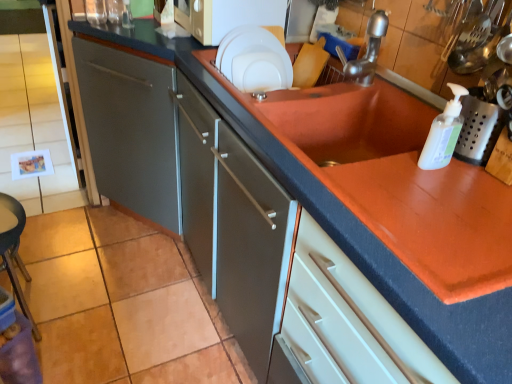
What do you see at coordinates (366, 51) in the screenshot? This screenshot has height=384, width=512. I see `silver metallic faucet at upper right` at bounding box center [366, 51].

The height and width of the screenshot is (384, 512). In order to click on white glossy plate at upper center in this screenshot , I will do (255, 59).

Considering the sizes of silver metallic faucet at upper right and white matte microwave at upper center in the image, is silver metallic faucet at upper right bigger or smaller than white matte microwave at upper center?

silver metallic faucet at upper right is smaller than white matte microwave at upper center.

Can you confirm if silver metallic faucet at upper right is shorter than white matte microwave at upper center?

Yes.

Is silver metallic faucet at upper right facing away from white matte microwave at upper center?

silver metallic faucet at upper right does not have its back to white matte microwave at upper center.

Can you tell me how much white plastic soap dispenser at upper right and white glossy plate at upper center differ in facing direction?

The angular difference between white plastic soap dispenser at upper right and white glossy plate at upper center is 83.6 degrees.

From the image's perspective, is white plastic soap dispenser at upper right under white glossy plate at upper center?

Yes, from the image's perspective, white plastic soap dispenser at upper right is beneath white glossy plate at upper center.

Does white plastic soap dispenser at upper right touch white glossy plate at upper center?

There is a gap between white plastic soap dispenser at upper right and white glossy plate at upper center.

Is point (440, 167) in front of point (258, 76)?

Yes, it is.

Based on their positions, is silver metallic faucet at upper right located to the left or right of white glossy plate at upper center?

In the image, silver metallic faucet at upper right appears on the right side of white glossy plate at upper center.

Does silver metallic faucet at upper right contain white glossy plate at upper center?

Definitely not — white glossy plate at upper center is not inside silver metallic faucet at upper right.

The height and width of the screenshot is (384, 512). Identify the location of tap lying above the white glossy plate at upper center (from the image's perspective). (366, 51).

From a real-world perspective, is silver metallic faucet at upper right over white glossy plate at upper center?

Indeed, from a real-world perspective, silver metallic faucet at upper right stands above white glossy plate at upper center.

Find the location of a particular element. microwave above the white plastic soap dispenser at upper right (from the image's perspective) is located at coordinates (226, 16).

Could you measure the distance between white plastic soap dispenser at upper right and white matte microwave at upper center?

white plastic soap dispenser at upper right and white matte microwave at upper center are 32.33 inches apart.

Based on the photo, which of these two, white plastic soap dispenser at upper right or white matte microwave at upper center, is smaller?

white plastic soap dispenser at upper right.

Can you confirm if white plastic soap dispenser at upper right is wider than white matte microwave at upper center?

No, white plastic soap dispenser at upper right is not wider than white matte microwave at upper center.

Considering the positions of points (257, 41) and (369, 70), is point (257, 41) farther from camera compared to point (369, 70)?

Yes, it is behind point (369, 70).

From the image's perspective, which one is positioned lower, white glossy plate at upper center or silver metallic faucet at upper right?

From the image's view, white glossy plate at upper center is below.

Considering the sizes of objects white glossy plate at upper center and silver metallic faucet at upper right in the image provided, who is wider, white glossy plate at upper center or silver metallic faucet at upper right?

With larger width is silver metallic faucet at upper right.

Is white glossy plate at upper center next to silver metallic faucet at upper right?

No, white glossy plate at upper center is not next to silver metallic faucet at upper right.

Based on the photo, between white glossy plate at upper center and white matte microwave at upper center, which one is positioned behind?

Positioned behind is white matte microwave at upper center.

From the image's perspective, is white glossy plate at upper center located above white matte microwave at upper center?

No, from the image's perspective, white glossy plate at upper center is not above white matte microwave at upper center.

Locate an element on the screen. The height and width of the screenshot is (384, 512). microwave located above the white glossy plate at upper center (from the image's perspective) is located at coordinates (226, 16).

Is silver metallic faucet at upper right positioned far away from white plastic soap dispenser at upper right?

No.

Consider the image. Is white plastic soap dispenser at upper right completely or partially inside silver metallic faucet at upper right?

That's incorrect, white plastic soap dispenser at upper right is not inside silver metallic faucet at upper right.

From the picture: Is silver metallic faucet at upper right turned away from white plastic soap dispenser at upper right?

silver metallic faucet at upper right does not have its back to white plastic soap dispenser at upper right.

The height and width of the screenshot is (384, 512). In order to click on microwave that appears behind the silver metallic faucet at upper right in this screenshot , I will do `click(226, 16)`.

There is a white glossy plate at upper center. Where is `bottle above it (from a real-world perspective)`? bottle above it (from a real-world perspective) is located at coordinates (443, 133).

Based on their spatial positions, is white plastic soap dispenser at upper right or white glossy plate at upper center further from white matte microwave at upper center?

white plastic soap dispenser at upper right is further to white matte microwave at upper center.

Based on their spatial positions, is white plastic soap dispenser at upper right or white matte microwave at upper center further from white glossy plate at upper center?

white plastic soap dispenser at upper right lies further to white glossy plate at upper center than the other object.

When comparing their distances from white glossy plate at upper center, does white plastic soap dispenser at upper right or silver metallic faucet at upper right seem closer?

silver metallic faucet at upper right lies closer to white glossy plate at upper center than the other object.

From the image, which object appears to be farther from white glossy plate at upper center, silver metallic faucet at upper right or white matte microwave at upper center?

Based on the image, silver metallic faucet at upper right appears to be further to white glossy plate at upper center.

Estimate the real-world distances between objects in this image. Which object is closer to silver metallic faucet at upper right, white plastic soap dispenser at upper right or white glossy plate at upper center?

white glossy plate at upper center is closer to silver metallic faucet at upper right.

When comparing their distances from white glossy plate at upper center, does white matte microwave at upper center or silver metallic faucet at upper right seem further?

Based on the image, silver metallic faucet at upper right appears to be further to white glossy plate at upper center.

From the image, which object appears to be nearer to white plastic soap dispenser at upper right, white matte microwave at upper center or white glossy plate at upper center?

Among the two, white glossy plate at upper center is located nearer to white plastic soap dispenser at upper right.

From the image, which object appears to be nearer to silver metallic faucet at upper right, white plastic soap dispenser at upper right or white matte microwave at upper center?

white plastic soap dispenser at upper right is closer to silver metallic faucet at upper right.

Where is `plate located between white plastic soap dispenser at upper right and white matte microwave at upper center in the depth direction`? The height and width of the screenshot is (384, 512). plate located between white plastic soap dispenser at upper right and white matte microwave at upper center in the depth direction is located at coordinates (255, 59).

The image size is (512, 384). What are the coordinates of `tap between white plastic soap dispenser at upper right and white glossy plate at upper center in the front-back direction` in the screenshot? It's located at (366, 51).

Find the location of a particular element. plate between white matte microwave at upper center and silver metallic faucet at upper right from left to right is located at coordinates (255, 59).

Locate an element on the screen. tap between white matte microwave at upper center and white plastic soap dispenser at upper right vertically is located at coordinates (366, 51).